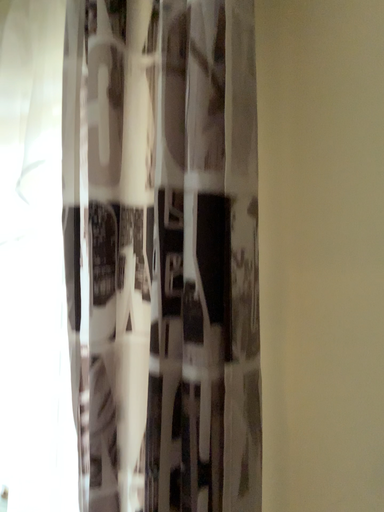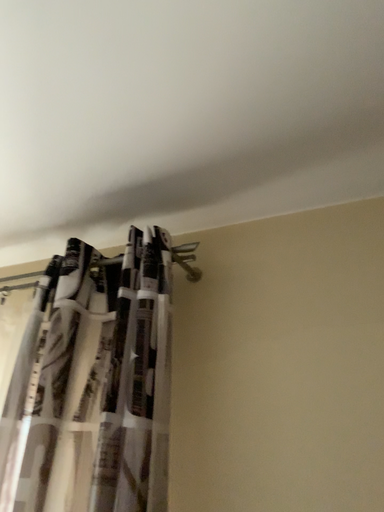
Question: Which way did the camera rotate in the video?

Choices:
 (A) rotated right
 (B) rotated left

Answer: (A)